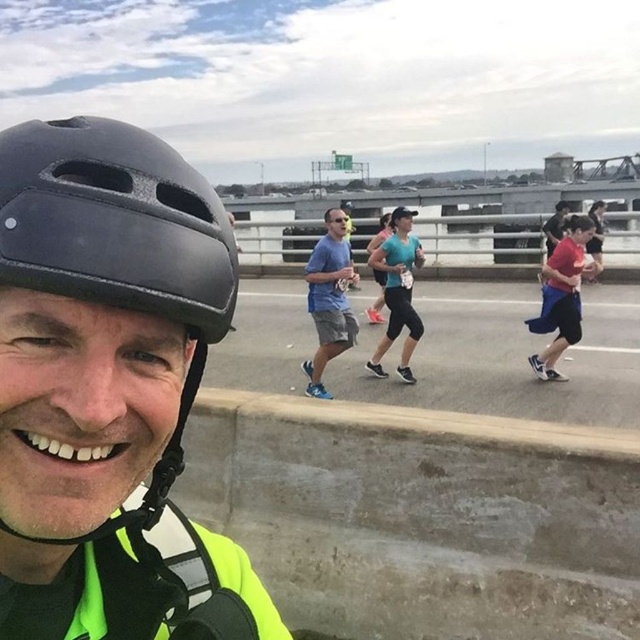
Can you confirm if blue fabric shirt at center is thinner than black matte sunglasses at center?

In fact, blue fabric shirt at center might be wider than black matte sunglasses at center.

Describe the element at coordinates (330, 301) in the screenshot. I see `blue fabric shirt at center` at that location.

You are a GUI agent. You are given a task and a screenshot of the screen. Output one action in this format:
    pyautogui.click(x=<x>, y=<y>)
    Task: Click on the blue fabric shirt at center
    
    Given the screenshot: What is the action you would take?
    pyautogui.click(x=330, y=301)

Which is in front, point (17, 352) or point (356, 275)?

Point (17, 352) is in front.

Which is above, matte black helmet at center or blue fabric shirt at center?

blue fabric shirt at center is above.

This screenshot has width=640, height=640. What do you see at coordinates (109, 388) in the screenshot?
I see `matte black helmet at center` at bounding box center [109, 388].

Locate an element on the screen. This screenshot has height=640, width=640. matte black helmet at center is located at coordinates (109, 388).

What do you see at coordinates (115, 221) in the screenshot? I see `black matte helmet at left` at bounding box center [115, 221].

Is black matte helmet at left taller than blue fabric shirt at center?

No.

Who is more forward, (16, 212) or (353, 282)?

Positioned in front is point (16, 212).

You are a GUI agent. You are given a task and a screenshot of the screen. Output one action in this format:
    pyautogui.click(x=<x>, y=<y>)
    Task: Click on the black matte helmet at left
    
    Given the screenshot: What is the action you would take?
    pyautogui.click(x=115, y=221)